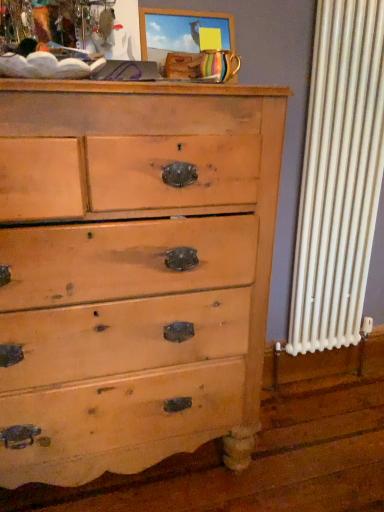
Question: Considering the relative sizes of light brown wood chest of drawers at center and wooden picture frame at upper center in the image provided, is light brown wood chest of drawers at center bigger than wooden picture frame at upper center?

Choices:
 (A) no
 (B) yes

Answer: (B)

Question: Is light brown wood chest of drawers at center aimed at wooden picture frame at upper center?

Choices:
 (A) yes
 (B) no

Answer: (B)

Question: Is light brown wood chest of drawers at center thinner than wooden picture frame at upper center?

Choices:
 (A) no
 (B) yes

Answer: (A)

Question: Is light brown wood chest of drawers at center facing away from wooden picture frame at upper center?

Choices:
 (A) yes
 (B) no

Answer: (B)

Question: Is light brown wood chest of drawers at center further to camera compared to wooden picture frame at upper center?

Choices:
 (A) yes
 (B) no

Answer: (B)

Question: From a real-world perspective, is light brown wood chest of drawers at center on wooden picture frame at upper center?

Choices:
 (A) yes
 (B) no

Answer: (B)

Question: Does wooden picture frame at upper center have a greater height compared to light brown wood chest of drawers at center?

Choices:
 (A) yes
 (B) no

Answer: (B)

Question: Are wooden picture frame at upper center and light brown wood chest of drawers at center located far from each other?

Choices:
 (A) yes
 (B) no

Answer: (B)

Question: Is wooden picture frame at upper center smaller than light brown wood chest of drawers at center?

Choices:
 (A) yes
 (B) no

Answer: (A)

Question: Can you confirm if wooden picture frame at upper center is shorter than light brown wood chest of drawers at center?

Choices:
 (A) no
 (B) yes

Answer: (B)

Question: From a real-world perspective, is wooden picture frame at upper center on light brown wood chest of drawers at center?

Choices:
 (A) yes
 (B) no

Answer: (A)

Question: Is wooden picture frame at upper center to the left of light brown wood chest of drawers at center from the viewer's perspective?

Choices:
 (A) no
 (B) yes

Answer: (A)

Question: Based on their positions, is wooden picture frame at upper center located to the left or right of light brown wood chest of drawers at center?

Choices:
 (A) right
 (B) left

Answer: (A)